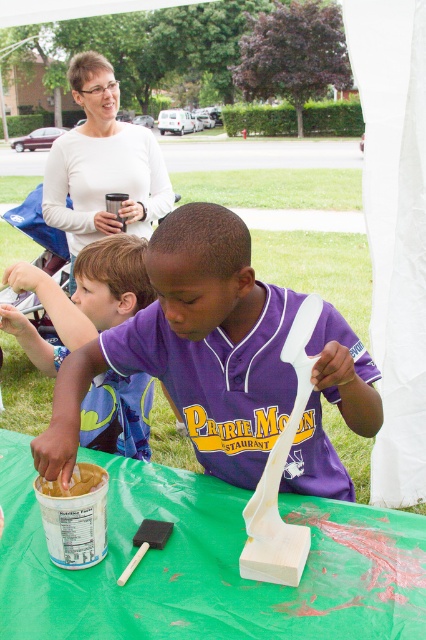
You are a photographer trying to capture a closeup of the purple jersey at center and the smooth beige paste at lower left. Since you want both objects to be in focus, you need to know their relative sizes. Which object is taller?

The purple jersey at center is much taller than the smooth beige paste at lower left.

You are a photographer trying to capture a closeup of the peanut butter container. You notice two points on the table surface, point A at coordinates point (13, 593) and point B at coordinates point (71, 480). Which point should you focus on to ensure the peanut butter container is in sharp focus?

Point A at coordinates point (13, 593) is closer to the camera than point B at coordinates point (71, 480), so focusing on point A will ensure the peanut butter container is in sharp focus.